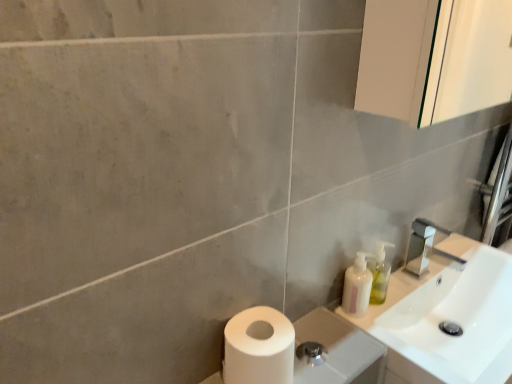
Question: Is translucent plastic soap dispenser at right taller or shorter than white matte toilet paper at lower left?

Choices:
 (A) tall
 (B) short

Answer: (A)

Question: Considering the positions of point (350, 266) and point (257, 329), is point (350, 266) closer or farther from the camera than point (257, 329)?

Choices:
 (A) farther
 (B) closer

Answer: (A)

Question: Which is nearer to the translucent plastic soap dispenser at right?

Choices:
 (A) translucent plastic soap dispenser at right
 (B) white matte toilet paper at lower left
 (C) white matte toilet paper at lower left
 (D) white glossy sink at upper right

Answer: (A)

Question: Estimate the real-world distances between objects in this image. Which object is farther from the translucent plastic soap dispenser at right?

Choices:
 (A) white matte toilet paper at lower left
 (B) white glossy sink at upper right
 (C) white matte toilet paper at lower left
 (D) translucent plastic soap dispenser at right

Answer: (C)